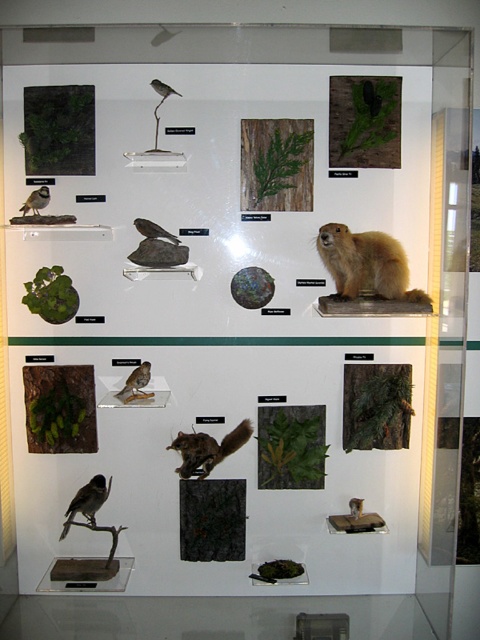
Question: Among these points, which one is nearest to the camera?

Choices:
 (A) (230, 444)
 (B) (94, 499)

Answer: (B)

Question: Is brown matte bird at center above matte black bird at upper center?

Choices:
 (A) no
 (B) yes

Answer: (A)

Question: Among these objects, which one is farthest from the camera?

Choices:
 (A) matte brown bird at left
 (B) brown feathered bird at center

Answer: (B)

Question: Which point is farther to the camera?

Choices:
 (A) matte black bird at upper center
 (B) brown matte bird at center

Answer: (B)

Question: Is matte black bird at lower left positioned before matte brown bird at left?

Choices:
 (A) no
 (B) yes

Answer: (A)

Question: Is brown furry squirrel at center bigger than matte black bird at lower left?

Choices:
 (A) yes
 (B) no

Answer: (A)